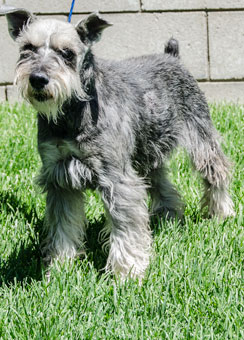
Identify the location of chest. This screenshot has height=340, width=244. (75, 147).